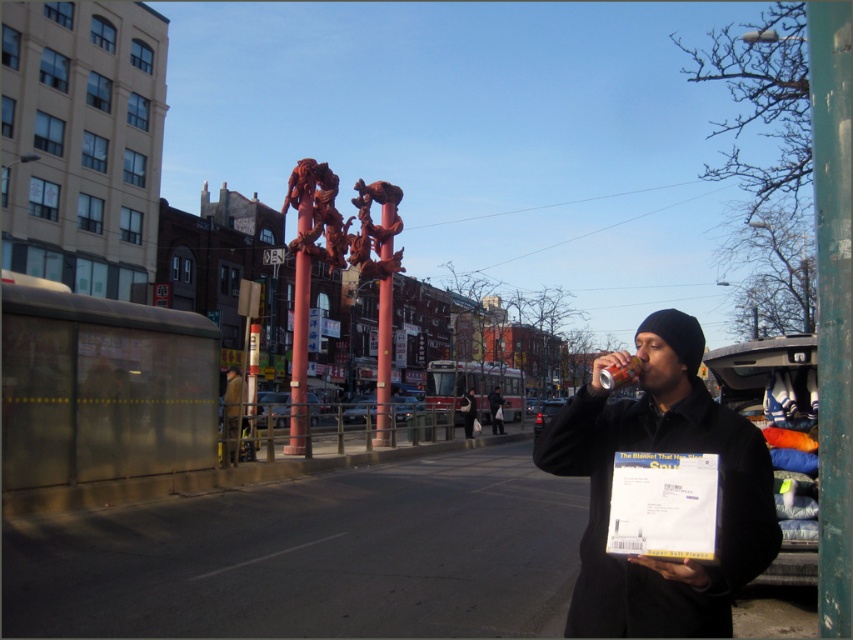
Looking at this image, measure the distance between matte black beanie at upper right and camera.

The distance of matte black beanie at upper right from camera is 2.09 meters.

Between matte black beanie at upper right and black knit cap at upper right, which one appears on the left side from the viewer's perspective?

black knit cap at upper right is more to the left.

Where is `matte black beanie at upper right`? The height and width of the screenshot is (640, 853). matte black beanie at upper right is located at coordinates click(662, 451).

What are the coordinates of `matte black beanie at upper right` in the screenshot? It's located at (662, 451).

From the picture: Does black knit hat at center have a greater width compared to black knit cap at upper right?

Incorrect, black knit hat at center's width does not surpass black knit cap at upper right's.

From the picture: Between black knit hat at center and black knit cap at upper right, which one appears on the right side from the viewer's perspective?

black knit cap at upper right

Who is more forward, (469,404) or (492,413)?

Point (469,404) is more forward.

Where is `black knit hat at center`? The height and width of the screenshot is (640, 853). black knit hat at center is located at coordinates (467, 412).

Is point (225, 412) farther from viewer compared to point (496, 396)?

No, (225, 412) is in front of (496, 396).

Who is lower down, dark brown leather jacket at center or black knit cap at upper right?

Positioned lower is black knit cap at upper right.

Does point (223, 432) come in front of point (489, 397)?

Yes, it is.

I want to click on dark brown leather jacket at center, so click(231, 412).